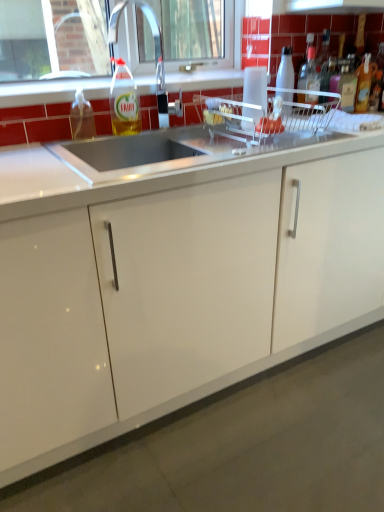
Question: Should I look upward or downward to see clear plastic dish rack at center?

Choices:
 (A) down
 (B) up

Answer: (B)

Question: From the image's perspective, is white glossy countertop at center, the second countertop positioned from the bottom, located beneath translucent plastic bottle at right, which ranks as the first bottle in right-to-left order?

Choices:
 (A) no
 (B) yes

Answer: (B)

Question: Is white glossy countertop at center, the second countertop positioned from the bottom, oriented away from translucent plastic bottle at right, which ranks as the first bottle in right-to-left order?

Choices:
 (A) no
 (B) yes

Answer: (A)

Question: From the image's perspective, is white glossy countertop at center, which appears as the 1th countertop when viewed from the top, over translucent plastic bottle at right, which ranks as the first bottle in right-to-left order?

Choices:
 (A) no
 (B) yes

Answer: (A)

Question: Does white glossy countertop at center, which appears as the 1th countertop when viewed from the top, have a lesser width compared to translucent plastic bottle at right, the sixth bottle from the left?

Choices:
 (A) yes
 (B) no

Answer: (B)

Question: Is white glossy countertop at center, which appears as the 1th countertop when viewed from the top, aimed at translucent plastic bottle at right, the sixth bottle from the left?

Choices:
 (A) no
 (B) yes

Answer: (A)

Question: Does white glossy countertop at center, which appears as the 1th countertop when viewed from the top, appear on the left side of translucent plastic bottle at right, which ranks as the first bottle in right-to-left order?

Choices:
 (A) no
 (B) yes

Answer: (B)

Question: Does translucent plastic soap dispenser at sink left, the sixth bottle in the right-to-left sequence, have a greater height compared to clear plastic dish rack at center?

Choices:
 (A) yes
 (B) no

Answer: (A)

Question: From the image's perspective, is translucent plastic soap dispenser at sink left, which appears as the 1th bottle when viewed from the left, below clear plastic dish rack at center?

Choices:
 (A) yes
 (B) no

Answer: (A)

Question: Does translucent plastic soap dispenser at sink left, which appears as the 1th bottle when viewed from the left, have a larger size compared to clear plastic dish rack at center?

Choices:
 (A) no
 (B) yes

Answer: (A)

Question: Considering the relative positions of translucent plastic soap dispenser at sink left, which appears as the 1th bottle when viewed from the left, and clear plastic dish rack at center in the image provided, is translucent plastic soap dispenser at sink left, which appears as the 1th bottle when viewed from the left, to the right of clear plastic dish rack at center from the viewer's perspective?

Choices:
 (A) no
 (B) yes

Answer: (A)

Question: Considering the relative sizes of translucent plastic soap dispenser at sink left, which appears as the 1th bottle when viewed from the left, and clear plastic dish rack at center in the image provided, is translucent plastic soap dispenser at sink left, which appears as the 1th bottle when viewed from the left, wider than clear plastic dish rack at center?

Choices:
 (A) no
 (B) yes

Answer: (A)

Question: Does translucent plastic soap dispenser at sink left, which appears as the 1th bottle when viewed from the left, lie behind clear plastic dish rack at center?

Choices:
 (A) yes
 (B) no

Answer: (A)

Question: Can you confirm if translucent plastic bottle at right, which ranks as the first bottle in right-to-left order, is shorter than white glossy bottle at upper right, the fourth bottle when ordered from right to left?

Choices:
 (A) yes
 (B) no

Answer: (A)